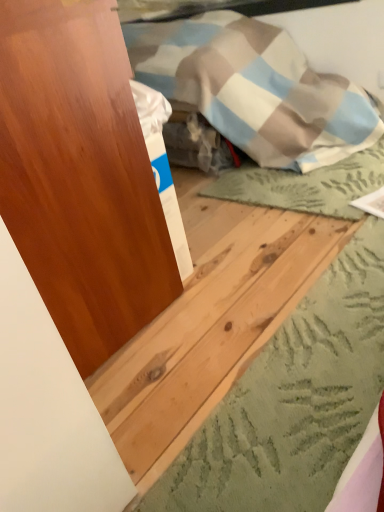
At what (x,y) coordinates should I click in order to perform the action: click on natural wood plank at center. Please return your answer as a coordinate pair (x, y). Image resolution: width=384 pixels, height=512 pixels. Looking at the image, I should click on (209, 336).

The image size is (384, 512). What do you see at coordinates (209, 336) in the screenshot?
I see `natural wood plank at center` at bounding box center [209, 336].

Consider the image. What is the approximate height of natural wood plank at center?

The height of natural wood plank at center is 1.83 inches.

Identify the location of matte wood dresser at left. (80, 177).

This screenshot has width=384, height=512. Describe the element at coordinates (80, 177) in the screenshot. I see `matte wood dresser at left` at that location.

Locate an element on the screen. Image resolution: width=384 pixels, height=512 pixels. natural wood plank at center is located at coordinates (209, 336).

Which is more to the left, natural wood plank at center or matte wood dresser at left?

Positioned to the left is matte wood dresser at left.

Is the depth of natural wood plank at center greater than that of matte wood dresser at left?

No, natural wood plank at center is in front of matte wood dresser at left.

Considering the positions of point (108, 418) and point (99, 157), is point (108, 418) closer or farther from the camera than point (99, 157)?

Point (108, 418) is positioned farther from the camera compared to point (99, 157).

From the image's perspective, which one is positioned lower, natural wood plank at center or matte wood dresser at left?

From the image's view, natural wood plank at center is below.

From a real-world perspective, does natural wood plank at center stand above matte wood dresser at left?

Actually, natural wood plank at center is physically below matte wood dresser at left in the real world.

Does natural wood plank at center have a lesser width compared to matte wood dresser at left?

In fact, natural wood plank at center might be wider than matte wood dresser at left.

Does natural wood plank at center have a lesser height compared to matte wood dresser at left?

Yes, natural wood plank at center is shorter than matte wood dresser at left.

Considering the relative sizes of natural wood plank at center and matte wood dresser at left in the image provided, is natural wood plank at center bigger than matte wood dresser at left?

No.

Would you say natural wood plank at center is outside matte wood dresser at left?

natural wood plank at center lies outside matte wood dresser at left's area.

Are natural wood plank at center and matte wood dresser at left making contact?

No, natural wood plank at center is not with matte wood dresser at left.

Consider the image. Is natural wood plank at center positioned with its back to matte wood dresser at left?

No, natural wood plank at center is not facing the opposite direction of matte wood dresser at left.

How different are the orientations of natural wood plank at center and matte wood dresser at left in degrees?

They differ by 2.41 degrees in their facing directions.

This screenshot has height=512, width=384. Identify the location of plywood in front of the matte wood dresser at left. (209, 336).

Is matte wood dresser at left at the right side of natural wood plank at center?

In fact, matte wood dresser at left is to the left of natural wood plank at center.

Is the depth of matte wood dresser at left greater than that of natural wood plank at center?

Yes, the depth of matte wood dresser at left is greater than that of natural wood plank at center.

Is point (49, 123) closer or farther from the camera than point (135, 338)?

Point (49, 123) is positioned closer to the camera compared to point (135, 338).

From the image's perspective, is matte wood dresser at left beneath natural wood plank at center?

No, from the image's perspective, matte wood dresser at left is not below natural wood plank at center.

From a real-world perspective, is matte wood dresser at left positioned above or below natural wood plank at center?

From a real-world perspective, matte wood dresser at left is physically above natural wood plank at center.

Which object is wider, matte wood dresser at left or natural wood plank at center?

natural wood plank at center is wider.

From their relative heights in the image, would you say matte wood dresser at left is taller or shorter than natural wood plank at center?

Considering their sizes, matte wood dresser at left has more height than natural wood plank at center.

Which of these two, matte wood dresser at left or natural wood plank at center, is smaller?

Smaller between the two is natural wood plank at center.

Is natural wood plank at center located within matte wood dresser at left?

No.

Is matte wood dresser at left with natural wood plank at center?

No, matte wood dresser at left is not in contact with natural wood plank at center.

Is matte wood dresser at left positioned with its back to natural wood plank at center?

No, matte wood dresser at left is not facing away from natural wood plank at center.

How much distance is there between matte wood dresser at left and natural wood plank at center?

The distance of matte wood dresser at left from natural wood plank at center is 11.72 inches.

There is a natural wood plank at center. Where is `dresser above it (from a real-world perspective)`? This screenshot has height=512, width=384. dresser above it (from a real-world perspective) is located at coordinates (80, 177).

This screenshot has width=384, height=512. I want to click on dresser lying above the natural wood plank at center (from the image's perspective), so click(x=80, y=177).

Find the location of a particular element. The image size is (384, 512). plywood in front of the matte wood dresser at left is located at coordinates (209, 336).